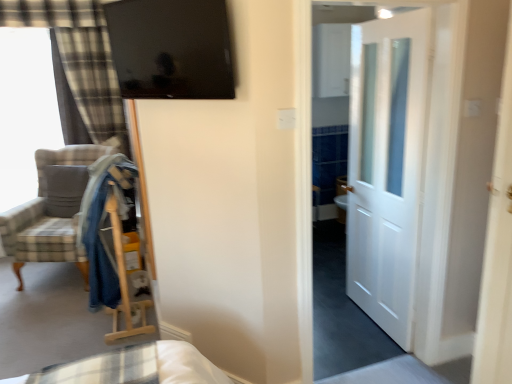
Question: From the image's perspective, is glossy black tv at upper center under white glossy door at center, which appears as the second door when viewed from the front?

Choices:
 (A) no
 (B) yes

Answer: (A)

Question: Does glossy black tv at upper center have a greater height compared to white glossy door at center, which appears as the second door when viewed from the front?

Choices:
 (A) yes
 (B) no

Answer: (B)

Question: Is glossy black tv at upper center directly adjacent to white glossy door at center, the first door positioned from the back?

Choices:
 (A) no
 (B) yes

Answer: (A)

Question: Does glossy black tv at upper center have a greater width compared to white glossy door at center, which appears as the second door when viewed from the front?

Choices:
 (A) no
 (B) yes

Answer: (A)

Question: Considering the relative positions of glossy black tv at upper center and white glossy door at center, which appears as the second door when viewed from the front, in the image provided, is glossy black tv at upper center to the right of white glossy door at center, which appears as the second door when viewed from the front, from the viewer's perspective?

Choices:
 (A) no
 (B) yes

Answer: (A)

Question: Is white glossy door at center, the first door positioned from the back, at the back of glossy black tv at upper center?

Choices:
 (A) yes
 (B) no

Answer: (B)

Question: Considering the relative positions of white wooden door at center, acting as the 2th door starting from the back, and plaid fabric armchair at left in the image provided, is white wooden door at center, acting as the 2th door starting from the back, behind plaid fabric armchair at left?

Choices:
 (A) no
 (B) yes

Answer: (A)

Question: Is plaid fabric armchair at left at the back of white wooden door at center, the 1th door from the front?

Choices:
 (A) no
 (B) yes

Answer: (A)

Question: Is white wooden door at center, acting as the 2th door starting from the back, at the right side of plaid fabric armchair at left?

Choices:
 (A) yes
 (B) no

Answer: (A)

Question: From a real-world perspective, is white wooden door at center, acting as the 2th door starting from the back, under plaid fabric armchair at left?

Choices:
 (A) no
 (B) yes

Answer: (A)

Question: From the image's perspective, is white wooden door at center, the 1th door from the front, on plaid fabric armchair at left?

Choices:
 (A) yes
 (B) no

Answer: (A)

Question: Is white wooden door at center, acting as the 2th door starting from the back, facing towards plaid fabric armchair at left?

Choices:
 (A) no
 (B) yes

Answer: (A)

Question: Is the depth of white wooden door at center, acting as the 2th door starting from the back, less than that of soft gray pillow at left?

Choices:
 (A) yes
 (B) no

Answer: (A)